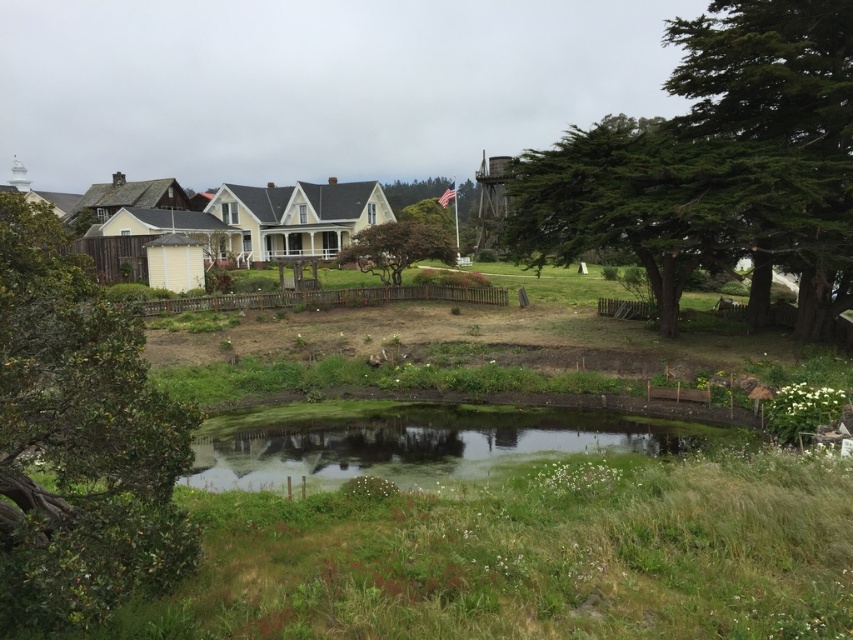
Question: Can you confirm if green textured tree at center right is smaller than green textured tree at center?

Choices:
 (A) yes
 (B) no

Answer: (B)

Question: Can you confirm if green leafy tree at left is thinner than brown textured tree at center?

Choices:
 (A) yes
 (B) no

Answer: (A)

Question: Does green textured tree at center appear on the right side of green grassy water at center?

Choices:
 (A) yes
 (B) no

Answer: (A)

Question: Which point is closer to the camera taking this photo?

Choices:
 (A) (370, 240)
 (B) (57, 560)

Answer: (B)

Question: Which of these objects is positioned closest to the brown textured tree at center?

Choices:
 (A) green textured tree at center right
 (B) green leafy tree at left
 (C) green grassy water at center
 (D) green textured tree at center

Answer: (D)

Question: Considering the real-world distances, which object is closest to the green textured tree at center right?

Choices:
 (A) brown textured tree at center
 (B) green leafy tree at left
 (C) green textured tree at center
 (D) green grassy water at center

Answer: (C)